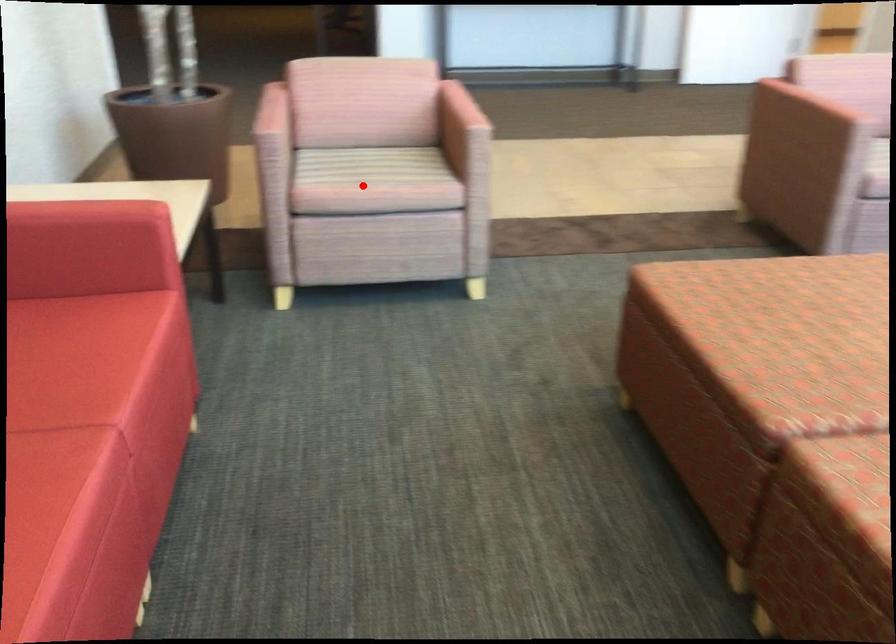
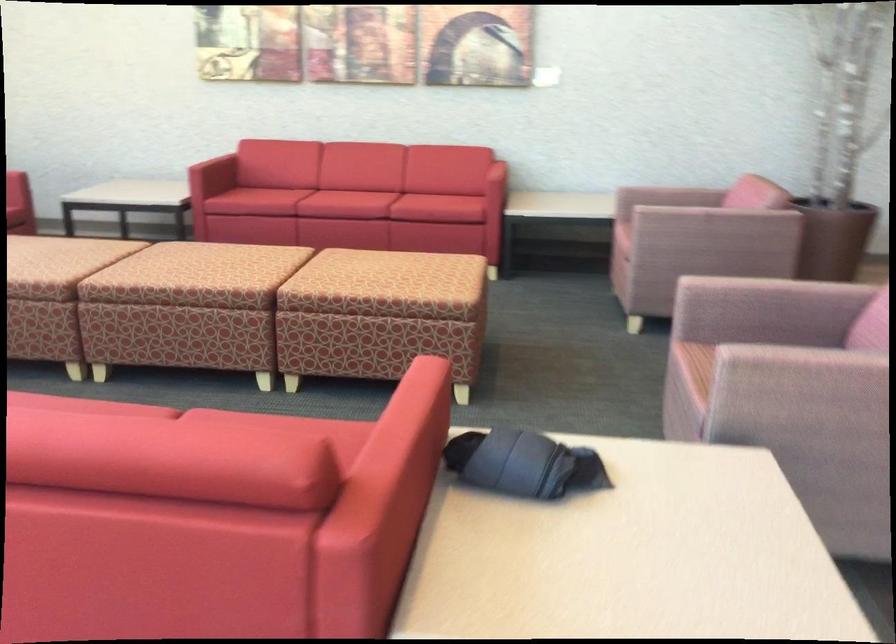
Question: A red point is marked in image1. In image2, is the corresponding 3D point closer to the camera or farther? Reply with the corresponding letter.

Choices:
 (A) The corresponding 3D point is closer.
 (B) The corresponding 3D point is farther.

Answer: (B)